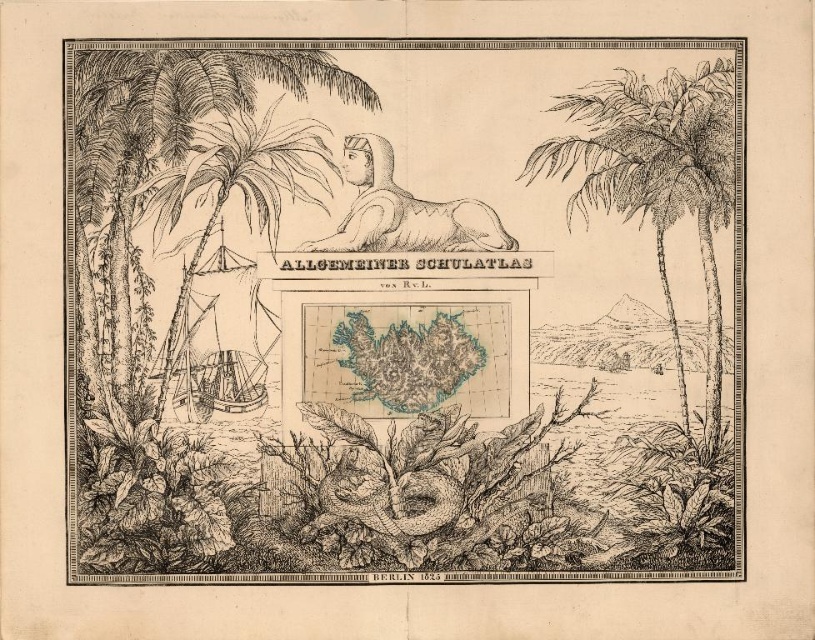
Based on the photo, you are an art conservator examining this 19th century atlas page. You need to determine if the blue ink map at center and the black ink palm tree at right can both fit on a preservation sheet that is 12 inches wide. The map is currently 10 inches wide, and the palm tree is 6 inches wide. Can both items fit side by side on the sheet without overlapping?

The blue ink map at center is larger in width than the black ink palm tree at right. Since the map is 10 inches wide and the palm tree is 6 inches wide, together they would require 16 inches of space. The preservation sheet is only 12 inches wide, so they cannot fit side by side without overlapping.

Based on the scene described, what can be found at the coordinates point (657, 179)?

At point (657, 179) lies black ink palm tree at right.